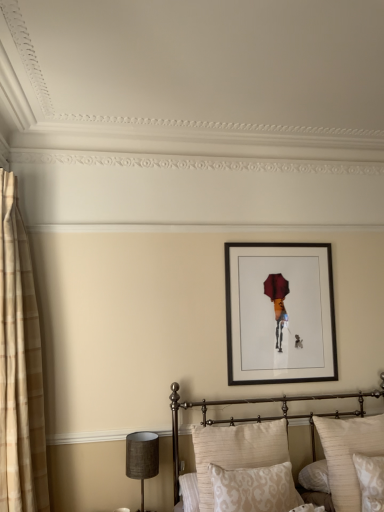
I want to click on free point above black matte picture frame at upper center (from a real-world perspective), so click(x=274, y=242).